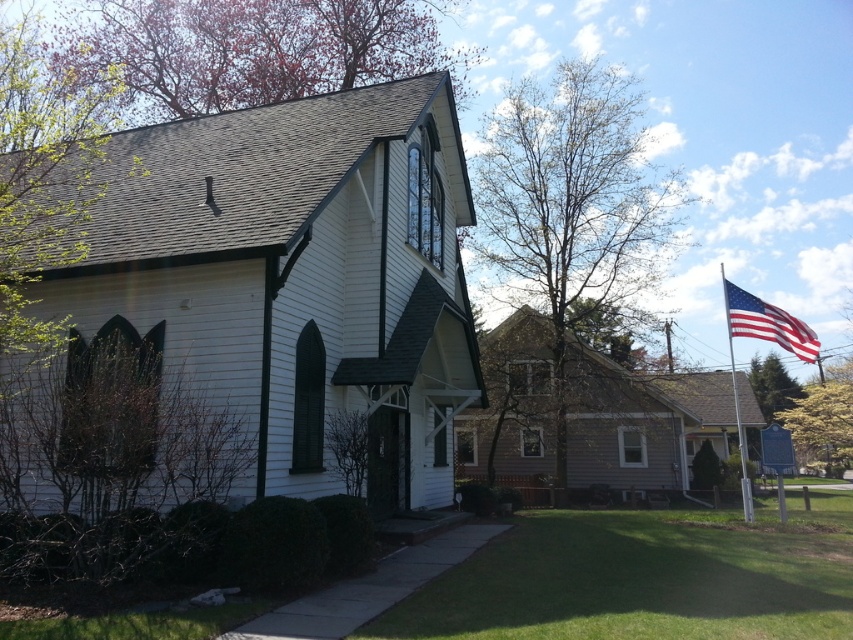
Question: Is american flag at upper right bigger than silver metallic flag pole at right?

Choices:
 (A) yes
 (B) no

Answer: (B)

Question: In this image, where is american flag at upper right located relative to silver metallic flag pole at right?

Choices:
 (A) below
 (B) above

Answer: (B)

Question: Observing the image, what is the correct spatial positioning of american flag at upper right in reference to silver metallic flag pole at right?

Choices:
 (A) above
 (B) below

Answer: (A)

Question: Estimate the real-world distances between objects in this image. Which object is closer to the white wood chapel at center?

Choices:
 (A) silver metallic flag pole at right
 (B) american flag at upper right

Answer: (B)

Question: Which object appears farthest from the camera in this image?

Choices:
 (A) white wood chapel at center
 (B) silver metallic flag pole at right

Answer: (B)

Question: Which object appears closest to the camera in this image?

Choices:
 (A) american flag at upper right
 (B) white wood chapel at center

Answer: (B)